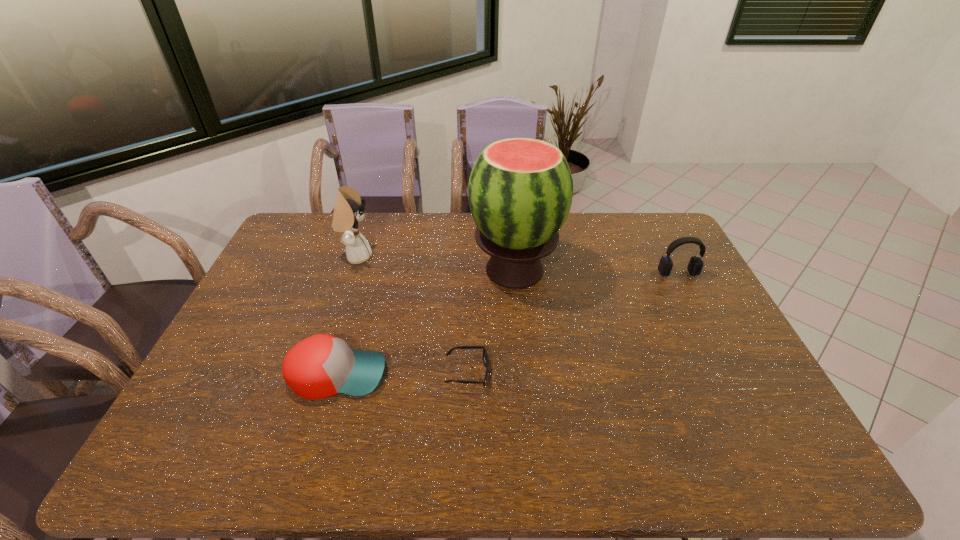
You are a GUI agent. You are given a task and a screenshot of the screen. Output one action in this format:
    pyautogui.click(x=<x>, y=<y>)
    Task: Click on the free space located 0.390m on the front-facing side of the sunglasses
    Image resolution: width=960 pixels, height=540 pixels.
    Given the screenshot: What is the action you would take?
    pyautogui.click(x=636, y=372)

Identify the location of watermelon at the far edge. The width and height of the screenshot is (960, 540). (520, 190).

You are a GUI agent. You are given a task and a screenshot of the screen. Output one action in this format:
    pyautogui.click(x=<x>, y=<y>)
    Task: Click on the doll situated at the far edge
    The width and height of the screenshot is (960, 540).
    Given the screenshot: What is the action you would take?
    pyautogui.click(x=348, y=211)

I want to click on object that is at the right edge, so click(695, 265).

I want to click on vacant space at the far edge of the desktop, so click(598, 227).

Find the location of a particular element. free space at the near edge of the desktop is located at coordinates (410, 471).

Identify the location of free space at the left edge. (254, 323).

You are a GUI agent. You are given a task and a screenshot of the screen. Output one action in this format:
    pyautogui.click(x=<x>, y=<y>)
    Task: Click on the free space at the far left corner of the desktop
    This screenshot has height=540, width=960.
    Given the screenshot: What is the action you would take?
    pyautogui.click(x=277, y=244)

Where is `vacant space at the near left corner`? This screenshot has height=540, width=960. vacant space at the near left corner is located at coordinates (212, 458).

In order to click on free space at the far right corner in this screenshot , I will do `click(665, 246)`.